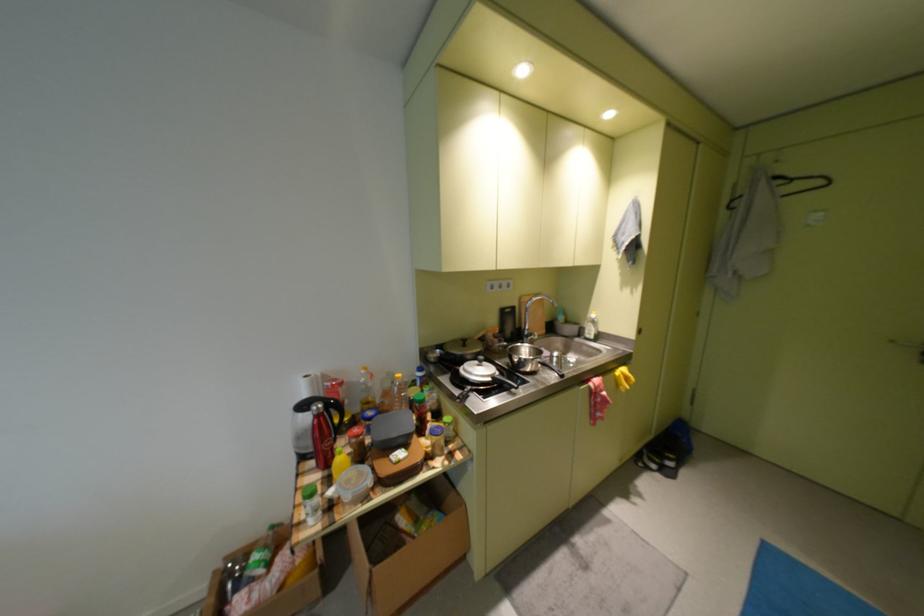
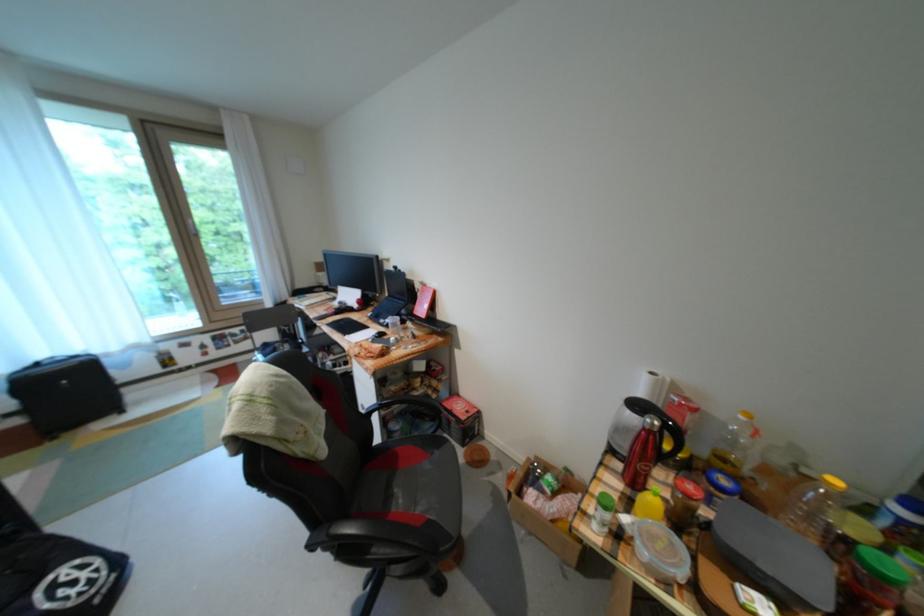
Find the pixel in the second image that matches point (315, 378) in the first image.

(662, 374)